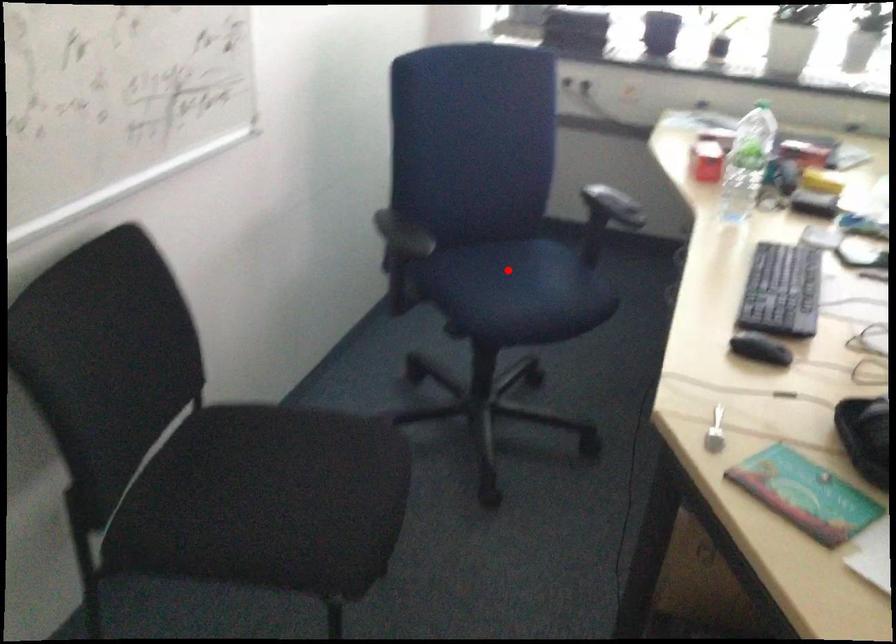
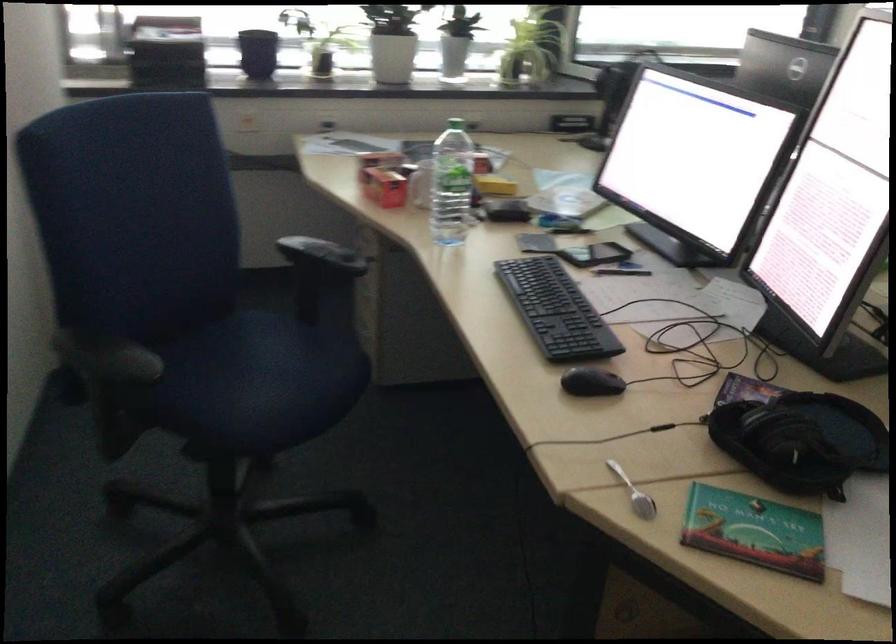
Question: I am providing you with two images of the same scene from different viewpoints. In image1, a red point is highlighted. Considering the same 3D point in image2, which of the following is correct?

Choices:
 (A) It is closer
 (B) It is farther

Answer: (A)